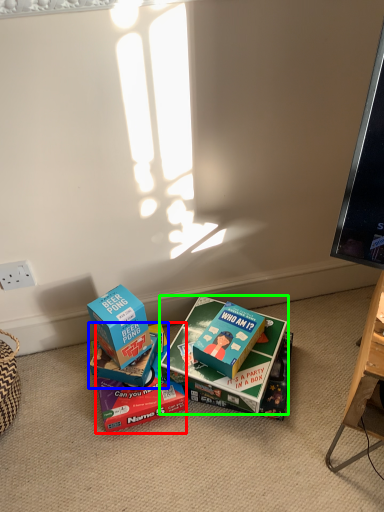
Question: Which is farther away from box (highlighted by a red box)? box (highlighted by a blue box) or box (highlighted by a green box)?

Choices:
 (A) box
 (B) box

Answer: (B)